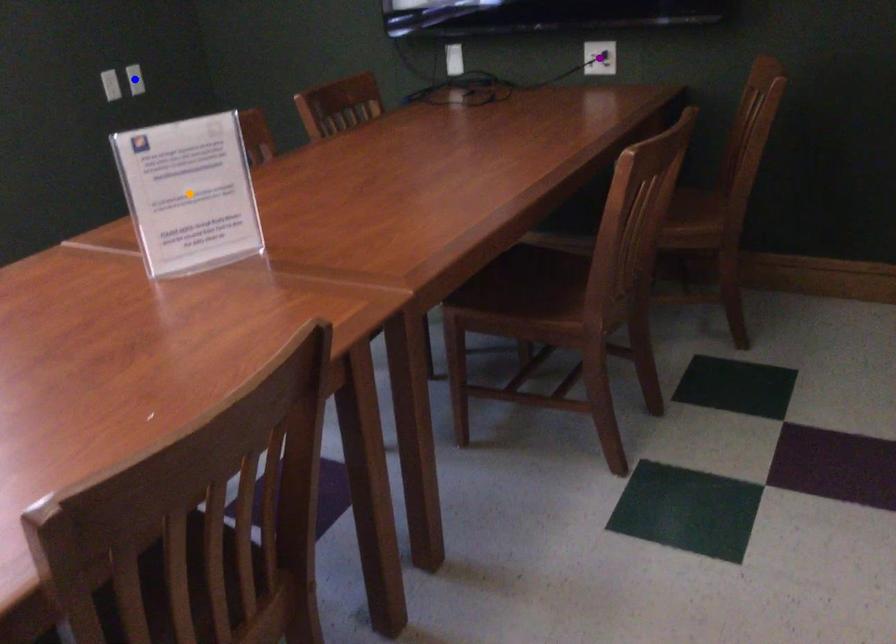
Order these from nearest to farthest:
A) orange point
B) blue point
C) purple point

blue point → purple point → orange point